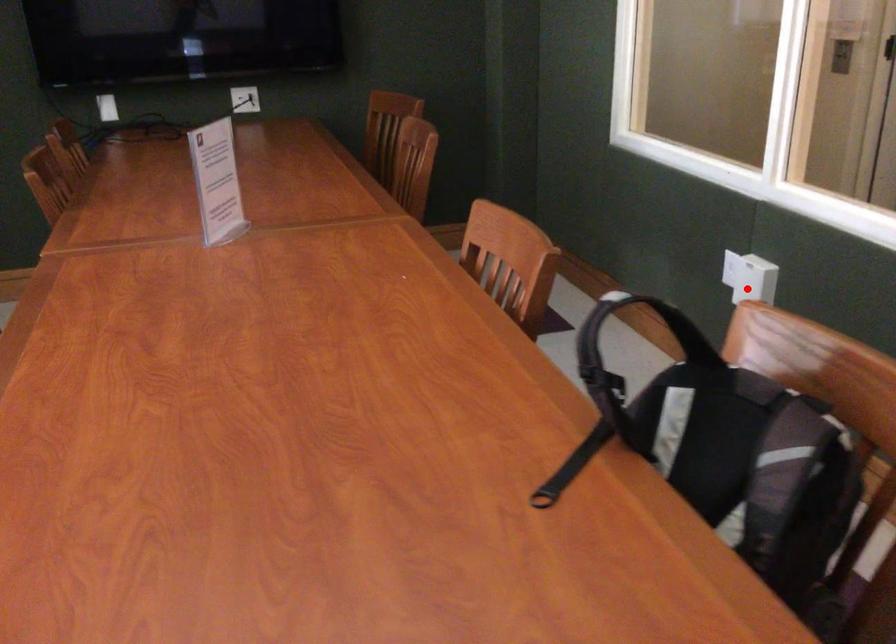
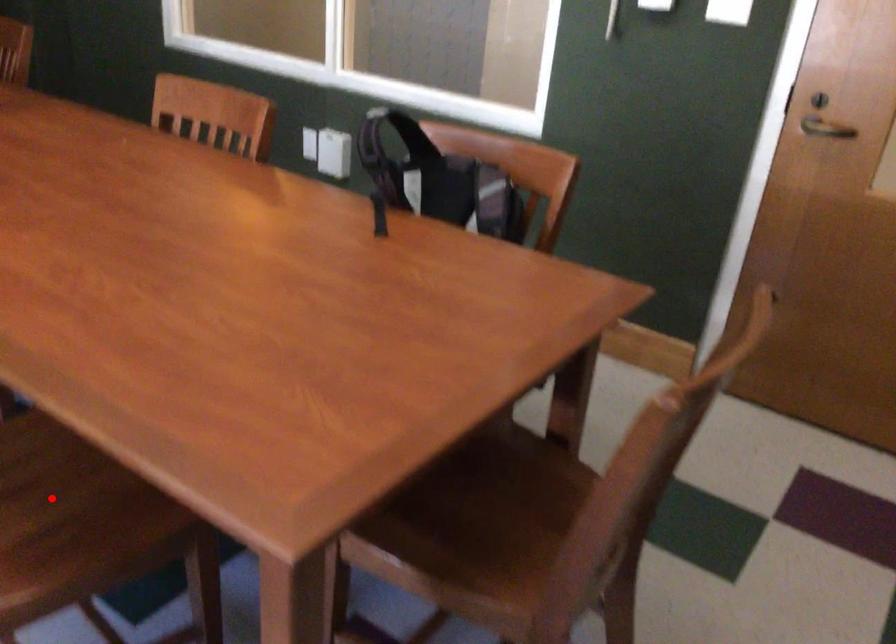
I am providing you with two images of the same scene from different viewpoints. A red point is marked on the first image and another point is marked on the second image. Is the marked point in image1 the same physical position as the marked point in image2?

No